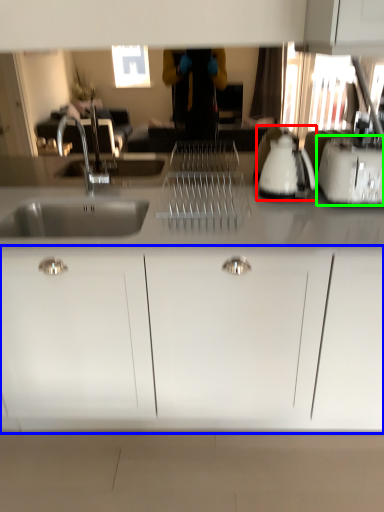
Question: Based on their relative distances, which object is nearer to appliance (highlighted by a red box)? Choose from cabinetry (highlighted by a blue box) and toaster (highlighted by a green box).

Choices:
 (A) cabinetry
 (B) toaster

Answer: (B)